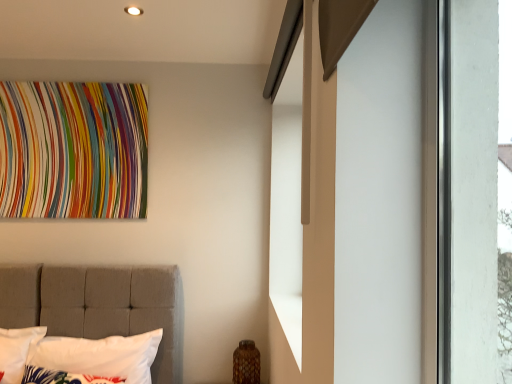
Question: Would you consider multicolored fabric tapestry at upper left to be distant from white tufted pillow at left, which is the second pillow in front-to-back order?

Choices:
 (A) no
 (B) yes

Answer: (A)

Question: Can you confirm if multicolored fabric tapestry at upper left is smaller than white tufted pillow at left, which is the second pillow in front-to-back order?

Choices:
 (A) yes
 (B) no

Answer: (A)

Question: From a real-world perspective, is multicolored fabric tapestry at upper left on top of white tufted pillow at left, the first pillow positioned from the back?

Choices:
 (A) no
 (B) yes

Answer: (B)

Question: From the image's perspective, would you say multicolored fabric tapestry at upper left is shown under white tufted pillow at left, which is the second pillow in front-to-back order?

Choices:
 (A) yes
 (B) no

Answer: (B)

Question: Does multicolored fabric tapestry at upper left appear on the left side of white tufted pillow at left, which is the second pillow in front-to-back order?

Choices:
 (A) yes
 (B) no

Answer: (A)

Question: From the image's perspective, relative to white tufted pillow at left, which is the second pillow in front-to-back order, is white fabric pillow at lower left, the 1th pillow viewed from the front, above or below?

Choices:
 (A) below
 (B) above

Answer: (A)

Question: Is white fabric pillow at lower left, acting as the 2th pillow starting from the back, wider or thinner than white tufted pillow at left, the first pillow positioned from the back?

Choices:
 (A) thin
 (B) wide

Answer: (A)

Question: Would you say white fabric pillow at lower left, acting as the 2th pillow starting from the back, is to the left or to the right of white tufted pillow at left, the first pillow positioned from the back, in the picture?

Choices:
 (A) right
 (B) left

Answer: (B)

Question: In terms of size, does white fabric pillow at lower left, the 1th pillow viewed from the front, appear bigger or smaller than white tufted pillow at left, the first pillow positioned from the back?

Choices:
 (A) small
 (B) big

Answer: (A)

Question: Considering the positions of white fabric pillow at lower left, acting as the 2th pillow starting from the back, and multicolored fabric tapestry at upper left in the image, is white fabric pillow at lower left, acting as the 2th pillow starting from the back, wider or thinner than multicolored fabric tapestry at upper left?

Choices:
 (A) wide
 (B) thin

Answer: (A)

Question: From a real-world perspective, is white fabric pillow at lower left, acting as the 2th pillow starting from the back, above or below multicolored fabric tapestry at upper left?

Choices:
 (A) above
 (B) below

Answer: (B)

Question: Does point (101, 375) appear closer or farther from the camera than point (28, 92)?

Choices:
 (A) farther
 (B) closer

Answer: (B)

Question: Relative to multicolored fabric tapestry at upper left, is white fabric pillow at lower left, the 1th pillow viewed from the front, in front or behind?

Choices:
 (A) behind
 (B) front

Answer: (B)

Question: In terms of width, does white tufted pillow at left, which is the second pillow in front-to-back order, look wider or thinner when compared to multicolored fabric tapestry at upper left?

Choices:
 (A) thin
 (B) wide

Answer: (B)

Question: Considering the relative positions of white tufted pillow at left, which is the second pillow in front-to-back order, and multicolored fabric tapestry at upper left in the image provided, is white tufted pillow at left, which is the second pillow in front-to-back order, to the left or to the right of multicolored fabric tapestry at upper left?

Choices:
 (A) left
 (B) right

Answer: (B)